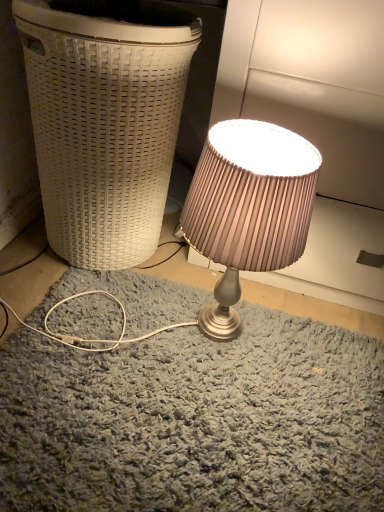
Question: From the image's perspective, is white woven basket at left located above satin pink lampshade at center?

Choices:
 (A) no
 (B) yes

Answer: (B)

Question: Is white woven basket at left at the right side of satin pink lampshade at center?

Choices:
 (A) yes
 (B) no

Answer: (B)

Question: Does white woven basket at left turn towards satin pink lampshade at center?

Choices:
 (A) yes
 (B) no

Answer: (B)

Question: From the image's perspective, is white woven basket at left located beneath satin pink lampshade at center?

Choices:
 (A) yes
 (B) no

Answer: (B)

Question: Considering the relative sizes of white woven basket at left and satin pink lampshade at center in the image provided, is white woven basket at left taller than satin pink lampshade at center?

Choices:
 (A) yes
 (B) no

Answer: (A)

Question: Is white woven basket at left next to satin pink lampshade at center and touching it?

Choices:
 (A) yes
 (B) no

Answer: (B)

Question: Is satin pink lampshade at center positioned with its back to white woven basket at left?

Choices:
 (A) yes
 (B) no

Answer: (B)

Question: Does satin pink lampshade at center turn towards white woven basket at left?

Choices:
 (A) no
 (B) yes

Answer: (A)

Question: From a real-world perspective, is satin pink lampshade at center positioned under white woven basket at left based on gravity?

Choices:
 (A) no
 (B) yes

Answer: (B)

Question: Is satin pink lampshade at center in front of white woven basket at left?

Choices:
 (A) yes
 (B) no

Answer: (A)

Question: Does satin pink lampshade at center have a lesser height compared to white woven basket at left?

Choices:
 (A) yes
 (B) no

Answer: (A)

Question: Does satin pink lampshade at center have a greater height compared to white woven basket at left?

Choices:
 (A) yes
 (B) no

Answer: (B)

Question: From a real-world perspective, relative to satin pink lampshade at center, is white woven basket at left vertically above or below?

Choices:
 (A) above
 (B) below

Answer: (A)